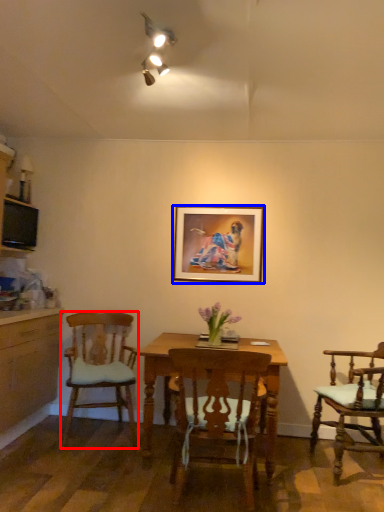
Question: Which object appears farthest to the camera in this image, chair (highlighted by a red box) or picture frame (highlighted by a blue box)?

Choices:
 (A) chair
 (B) picture frame

Answer: (B)